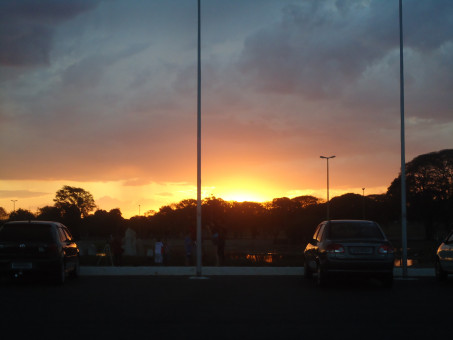
The image size is (453, 340). In order to click on lamp in this screenshot , I will do `click(197, 48)`, `click(328, 178)`, `click(363, 190)`, `click(403, 174)`, `click(13, 204)`, `click(138, 211)`.